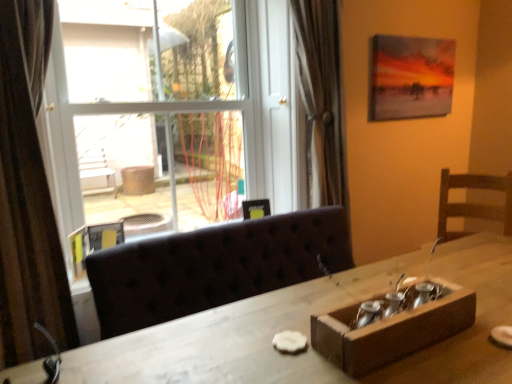
You are a GUI agent. You are given a task and a screenshot of the screen. Output one action in this format:
    pyautogui.click(x=<x>, y=<y>)
    Task: Click on the matte canvas painting at upper right, arranged as the first picture frame when viewed from the right
    The height and width of the screenshot is (384, 512).
    Given the screenshot: What is the action you would take?
    pyautogui.click(x=410, y=77)

Find the location of `transparent glass window at upper left`. transparent glass window at upper left is located at coordinates (204, 109).

Where is `metallic silver picture frame at left, which is the first picture frame from left to right`? metallic silver picture frame at left, which is the first picture frame from left to right is located at coordinates (78, 251).

Where is `wooden table at center`? wooden table at center is located at coordinates (308, 335).

Is wooden table at center positioned far away from wooden box at lower right?

No, wooden table at center is not far from wooden box at lower right.

Based on the photo, is wooden table at center not inside wooden box at lower right?

Indeed, wooden table at center is completely outside wooden box at lower right.

Does point (125, 334) come farther from viewer compared to point (434, 317)?

Yes, point (125, 334) is farther from viewer.

Is wooden table at center positioned behind wooden box at lower right?

No, it is not.

Can you confirm if transparent glass window at upper left is shorter than wooden box at lower right?

No.

Does transparent glass window at upper left come in front of wooden box at lower right?

That is False.

Which is closer, (222, 45) or (355, 364)?

Point (222, 45) is positioned farther from the camera compared to point (355, 364).

From the image's perspective, which one is positioned higher, transparent glass window at upper left or wooden box at lower right?

transparent glass window at upper left, from the image's perspective.

Considering the relative positions of wooden table at center and matte canvas painting at upper right, arranged as the first picture frame when viewed from the right, in the image provided, is wooden table at center to the left of matte canvas painting at upper right, arranged as the first picture frame when viewed from the right, from the viewer's perspective?

Indeed, wooden table at center is positioned on the left side of matte canvas painting at upper right, arranged as the first picture frame when viewed from the right.

Between wooden table at center and matte canvas painting at upper right, which appears as the 2th picture frame when viewed from the left, which one has more height?

wooden table at center is taller.

Which point is more forward, (168, 368) or (398, 71)?

The point (168, 368) is closer.

Considering their positions, is metallic silver picture frame at left, positioned as the 1th picture frame in bottom-to-top order, located in front of or behind matte canvas painting at upper right, the 1th picture frame positioned from the top?

In the image, metallic silver picture frame at left, positioned as the 1th picture frame in bottom-to-top order, appears in front of matte canvas painting at upper right, the 1th picture frame positioned from the top.

Is metallic silver picture frame at left, which is counted as the 2th picture frame, starting from the back, facing away from matte canvas painting at upper right, arranged as the first picture frame when viewed from the right?

No, metallic silver picture frame at left, which is counted as the 2th picture frame, starting from the back, is not facing away from matte canvas painting at upper right, arranged as the first picture frame when viewed from the right.

Looking at this image, is metallic silver picture frame at left, which is the first picture frame from left to right, to the left of matte canvas painting at upper right, which appears as the 2th picture frame when viewed from the left, from the viewer's perspective?

Yes.

Considering the positions of point (73, 277) and point (373, 77), is point (73, 277) closer or farther from the camera than point (373, 77)?

Point (73, 277) appears to be closer to the viewer than point (373, 77).

Which is behind, point (464, 303) or point (84, 270)?

The point (84, 270) is more distant.

Which object is positioned more to the right, wooden box at lower right or metallic silver picture frame at left, which is the first picture frame from front to back?

From the viewer's perspective, wooden box at lower right appears more on the right side.

Does wooden box at lower right have a greater width compared to metallic silver picture frame at left, positioned as the 1th picture frame in bottom-to-top order?

Yes, wooden box at lower right is wider than metallic silver picture frame at left, positioned as the 1th picture frame in bottom-to-top order.

In the scene shown: Could you tell me if wooden box at lower right is facing metallic silver picture frame at left, which is the first picture frame from left to right?

No.

You are a GUI agent. You are given a task and a screenshot of the screen. Output one action in this format:
    pyautogui.click(x=<x>, y=<y>)
    Task: Click on the curtain that is behind the wooden box at lower right
    
    Given the screenshot: What is the action you would take?
    pyautogui.click(x=28, y=194)

Based on the photo, is brown textured curtain at left to the left of wooden box at lower right from the viewer's perspective?

Yes, brown textured curtain at left is to the left of wooden box at lower right.

Is brown textured curtain at left positioned behind wooden box at lower right?

Yes, brown textured curtain at left is further from the viewer.

Considering the relative sizes of brown textured curtain at left and wooden box at lower right in the image provided, is brown textured curtain at left taller than wooden box at lower right?

Yes.

Which object is further away from the camera, brown textured curtain at left or transparent glass window at upper left?

transparent glass window at upper left is further from the camera.

Is brown textured curtain at left not near transparent glass window at upper left?

No, there isn't a large distance between brown textured curtain at left and transparent glass window at upper left.

Where is `curtain directly beneath the transparent glass window at upper left (from a real-world perspective)`? curtain directly beneath the transparent glass window at upper left (from a real-world perspective) is located at coordinates (28, 194).

The width and height of the screenshot is (512, 384). I want to click on desk on the right of wooden box at lower right, so click(308, 335).

In the image, there is a wooden box at lower right. Identify the location of window above it (from the image's perspective). The image size is (512, 384). (204, 109).

Estimate the real-world distances between objects in this image. Which object is further from metallic silver picture frame at left, placed as the second picture frame when sorted from top to bottom, brown textured curtain at left or wooden box at lower right?

The object further to metallic silver picture frame at left, placed as the second picture frame when sorted from top to bottom, is wooden box at lower right.

When comparing their distances from matte canvas painting at upper right, the 1th picture frame positioned from the top, does wooden table at center or transparent glass window at upper left seem closer?

transparent glass window at upper left lies closer to matte canvas painting at upper right, the 1th picture frame positioned from the top, than the other object.

From the image, which object appears to be nearer to matte canvas painting at upper right, the 2th picture frame from the front, wooden table at center or wooden box at lower right?

wooden table at center lies closer to matte canvas painting at upper right, the 2th picture frame from the front, than the other object.

From the image, which object appears to be farther from brown textured curtain at left, wooden table at center or matte canvas painting at upper right, arranged as the first picture frame when viewed from the right?

The object further to brown textured curtain at left is matte canvas painting at upper right, arranged as the first picture frame when viewed from the right.

From the image, which object appears to be farther from brown textured curtain at left, wooden box at lower right or transparent glass window at upper left?

Among the two, wooden box at lower right is located further to brown textured curtain at left.

Looking at the image, which one is located closer to transparent glass window at upper left, brown textured curtain at left or wooden table at center?

brown textured curtain at left is positioned closer to the anchor transparent glass window at upper left.

Which object lies nearer to the anchor point metallic silver picture frame at left, placed as the second picture frame when sorted from top to bottom, transparent glass window at upper left or wooden box at lower right?

transparent glass window at upper left is positioned closer to the anchor metallic silver picture frame at left, placed as the second picture frame when sorted from top to bottom.

From the image, which object appears to be nearer to brown textured curtain at left, metallic silver picture frame at left, which is the first picture frame from left to right, or wooden box at lower right?

metallic silver picture frame at left, which is the first picture frame from left to right, lies closer to brown textured curtain at left than the other object.

Where is `cardboard box situated between metallic silver picture frame at left, which is the 2th picture frame from right to left, and wooden table at center from left to right`? cardboard box situated between metallic silver picture frame at left, which is the 2th picture frame from right to left, and wooden table at center from left to right is located at coordinates pyautogui.click(x=390, y=329).

Identify the location of curtain between wooden table at center and matte canvas painting at upper right, the 2th picture frame from the front, in the front-back direction. (28, 194).

The width and height of the screenshot is (512, 384). Identify the location of cardboard box between brown textured curtain at left and matte canvas painting at upper right, the 1th picture frame positioned from the top, from left to right. (390, 329).

At what (x,y) coordinates should I click in order to perform the action: click on picture frame between brown textured curtain at left and wooden table at center in the horizontal direction. Please return your answer as a coordinate pair (x, y). The image size is (512, 384). Looking at the image, I should click on (78, 251).